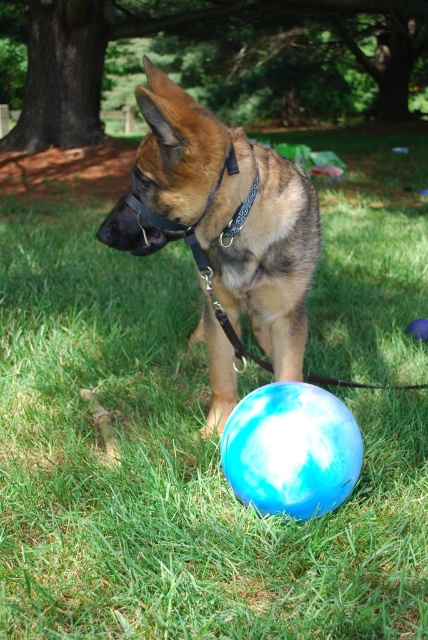
Question: Is brown fur dog at center positioned before blue glossy ball at center?

Choices:
 (A) yes
 (B) no

Answer: (A)

Question: Can you confirm if brown fur dog at center is positioned above blue glossy ball at center?

Choices:
 (A) no
 (B) yes

Answer: (B)

Question: Does brown fur dog at center have a greater width compared to blue glossy ball at center?

Choices:
 (A) yes
 (B) no

Answer: (A)

Question: Which point is farther from the camera taking this photo?

Choices:
 (A) (265, 147)
 (B) (308, 449)

Answer: (A)